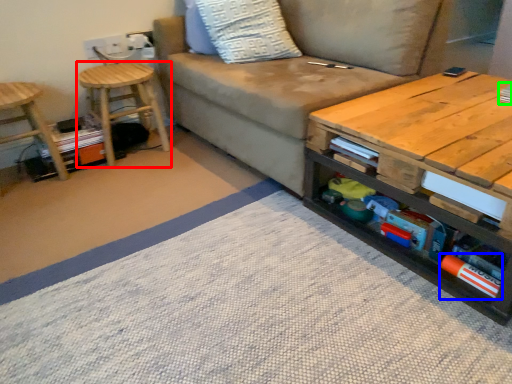
Question: Based on their relative distances, which object is nearer to stool (highlighted by a red box)? Choose from book (highlighted by a blue box) and book (highlighted by a green box).

Choices:
 (A) book
 (B) book

Answer: (A)